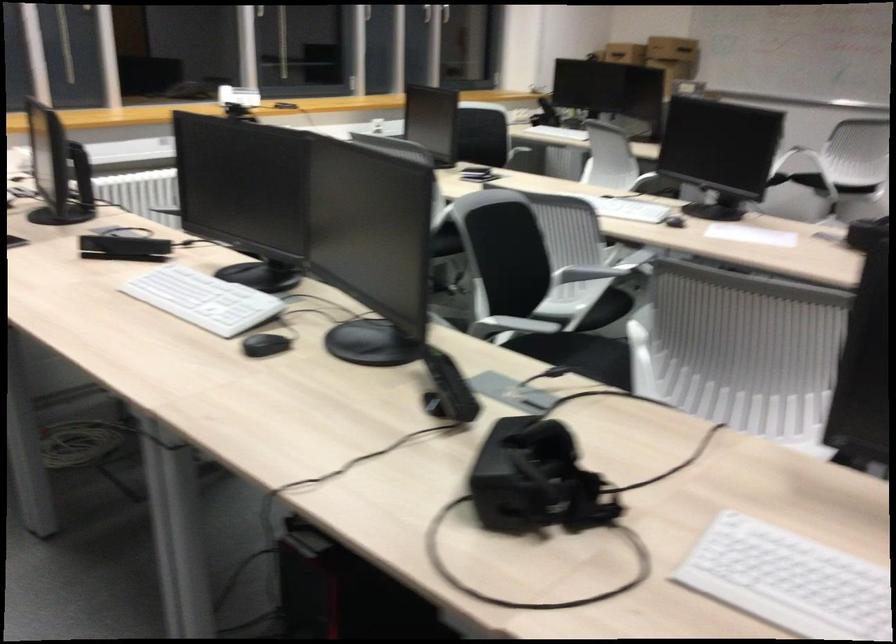
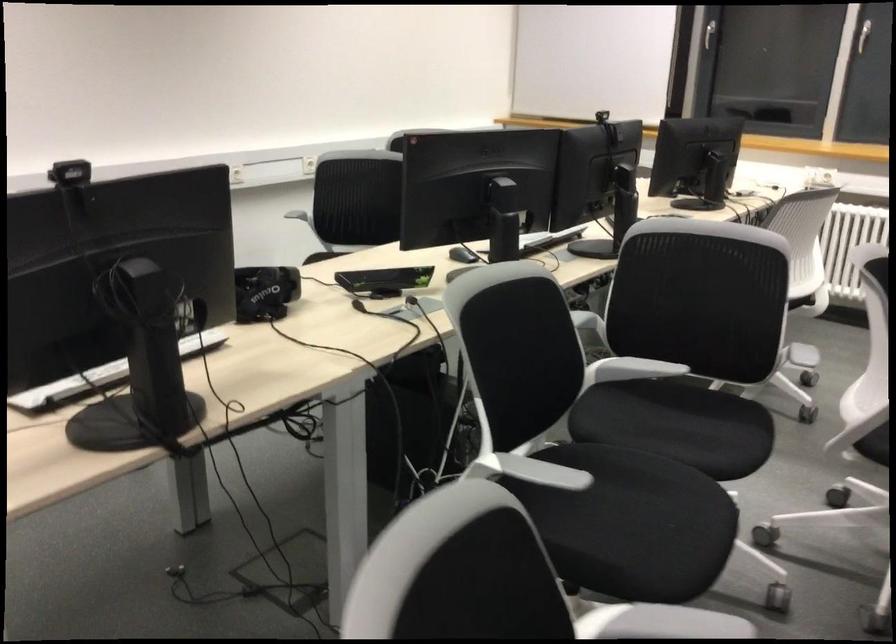
Where in the second image is the point corresponding to point (598, 366) from the first image?

(676, 424)